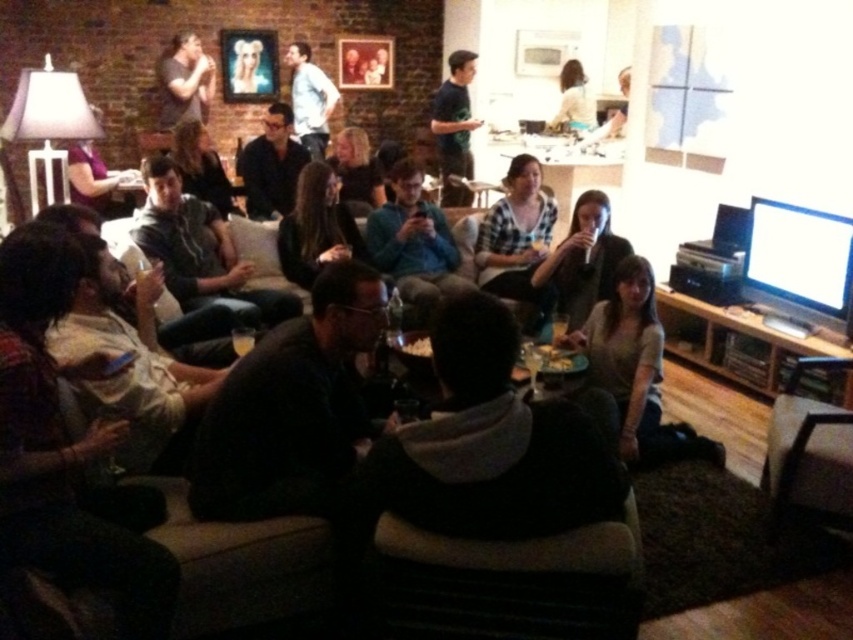
You are at a party and want to find the person wearing the matte black shirt at upper left. Since you can only see the white shirt at upper center clearly, which one is smaller?

The matte black shirt at upper left is smaller than the white shirt at upper center.

You are at the coordinates 0.6, 0.3 in the living room. You see the dark brown leather jacket at center. Which direction should you move to reach it?

The dark brown leather jacket at center is located at point (292,408), so you should move northeast to reach it from your current coordinates (254,384).

You are a photographer at the event and want to take a group photo. You notice the matte black shirt at center and the light brown hair at upper center. Which object should you adjust to ensure both are fully visible in the frame?

The matte black shirt at center has a larger width than the light brown hair at upper center, so you should adjust the frame to accommodate the width of the matte black shirt at center to ensure both are fully visible.